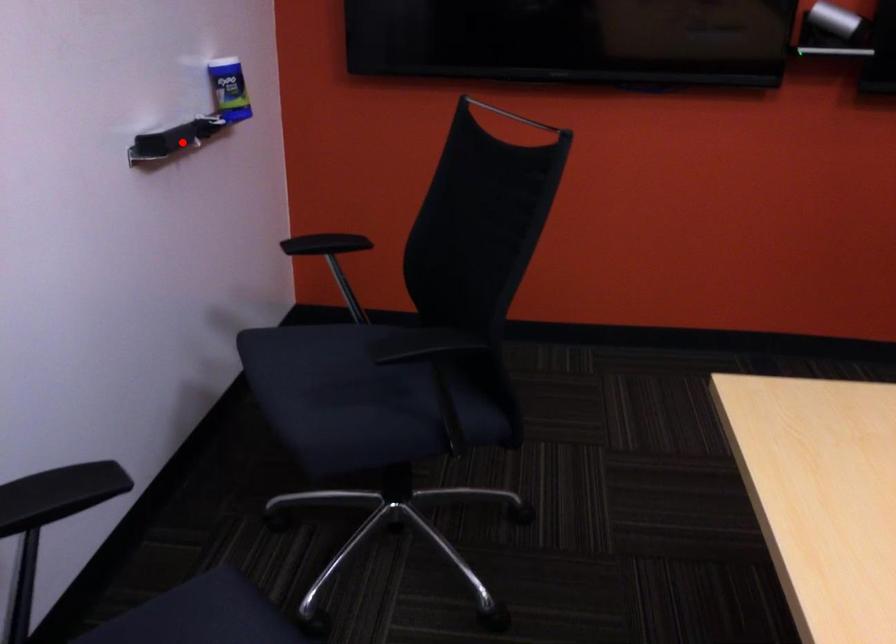
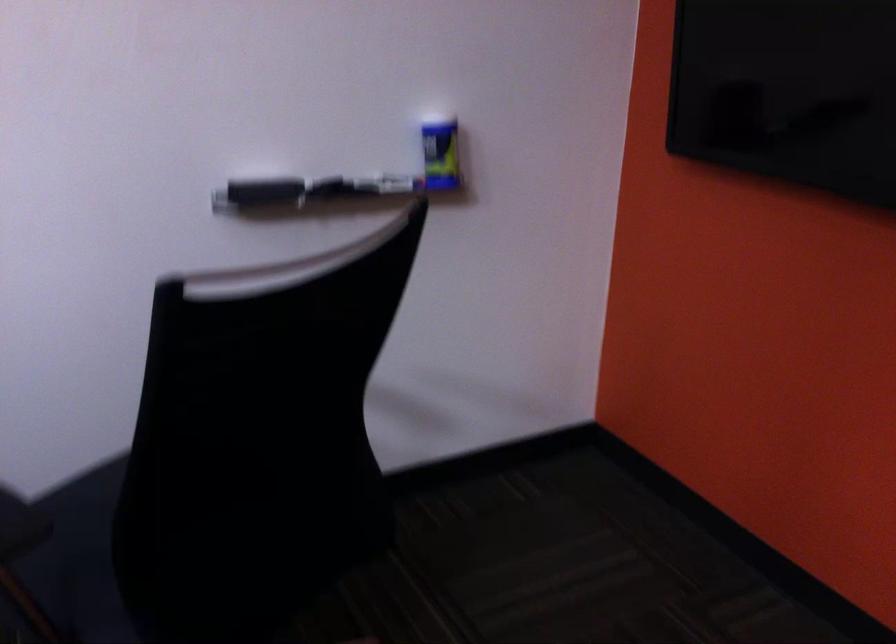
The point at the highlighted location is marked in the first image. Where is the corresponding point in the second image?

(261, 191)